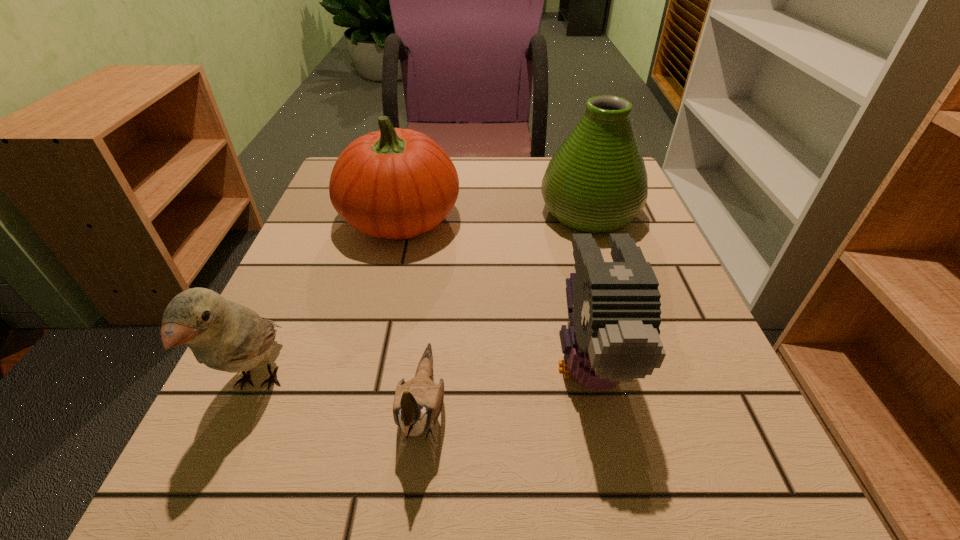
The height and width of the screenshot is (540, 960). In order to click on free space between the second bird from right to left and the rightmost bird in this screenshot , I will do `click(505, 385)`.

Where is `free space between the pumpkin and the shortest bird`? free space between the pumpkin and the shortest bird is located at coordinates (412, 313).

Find the location of a particular element. This screenshot has height=540, width=960. vacant region between the shortest object and the rightmost bird is located at coordinates (505, 385).

Point out which object is positioned as the fourth nearest to the vase. Please provide its 2D coordinates. Your answer should be formatted as a tuple, i.e. [(x, y)], where the tuple contains the x and y coordinates of a point satisfying the conditions above.

[(226, 336)]

Point out which object is positioned as the third nearest to the rightmost bird. Please provide its 2D coordinates. Your answer should be formatted as a tuple, i.e. [(x, y)], where the tuple contains the x and y coordinates of a point satisfying the conditions above.

[(394, 183)]

Locate an element on the screen. bird that stands as the third closest to the pumpkin is located at coordinates (417, 404).

The width and height of the screenshot is (960, 540). I want to click on bird that is the closest to the leftmost bird, so click(417, 404).